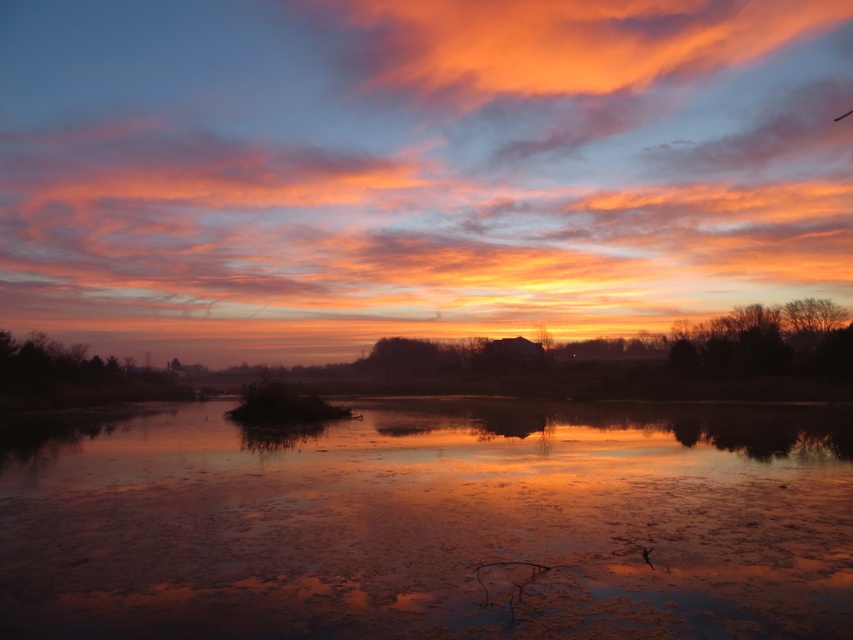
Locate an element on the screen. This screenshot has width=853, height=640. matte orange cloud at upper center is located at coordinates (415, 170).

Is matte orange cloud at upper center behind smooth reflective water at center?

Yes, matte orange cloud at upper center is further from the viewer.

Does point (532, 51) come farther from viewer compared to point (62, 564)?

Yes, point (532, 51) is farther from viewer.

Where is `matte orange cloud at upper center`? The width and height of the screenshot is (853, 640). matte orange cloud at upper center is located at coordinates (415, 170).